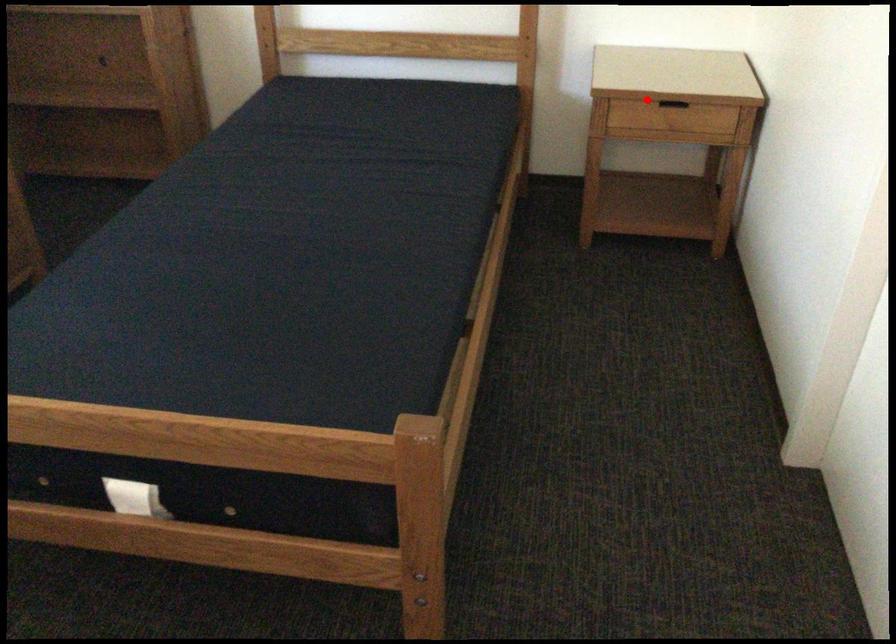
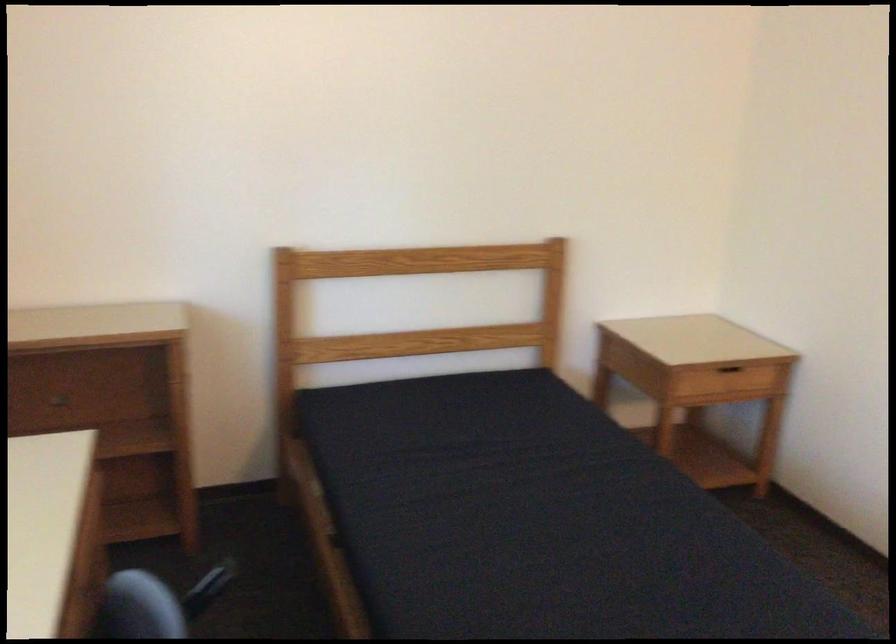
The point at the highlighted location is marked in the first image. Where is the corresponding point in the second image?

(727, 368)